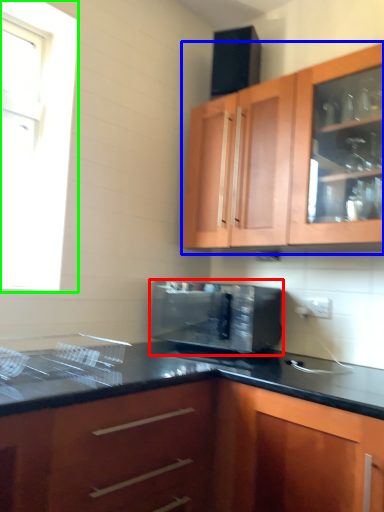
Question: Which is farther away from microwave oven (highlighted by a red box)? cabinetry (highlighted by a blue box) or window (highlighted by a green box)?

Choices:
 (A) cabinetry
 (B) window

Answer: (B)